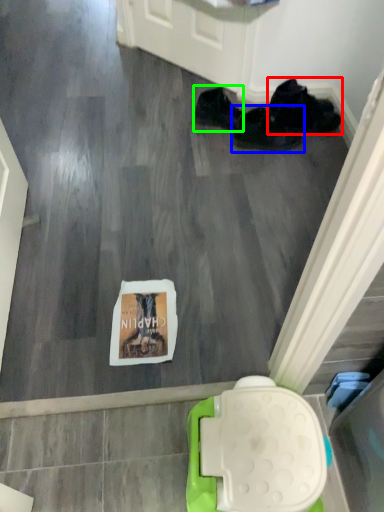
Question: Which object is the farthest from footwear (highlighted by a red box)? Choose among these: footwear (highlighted by a blue box) or footwear (highlighted by a green box).

Choices:
 (A) footwear
 (B) footwear

Answer: (B)